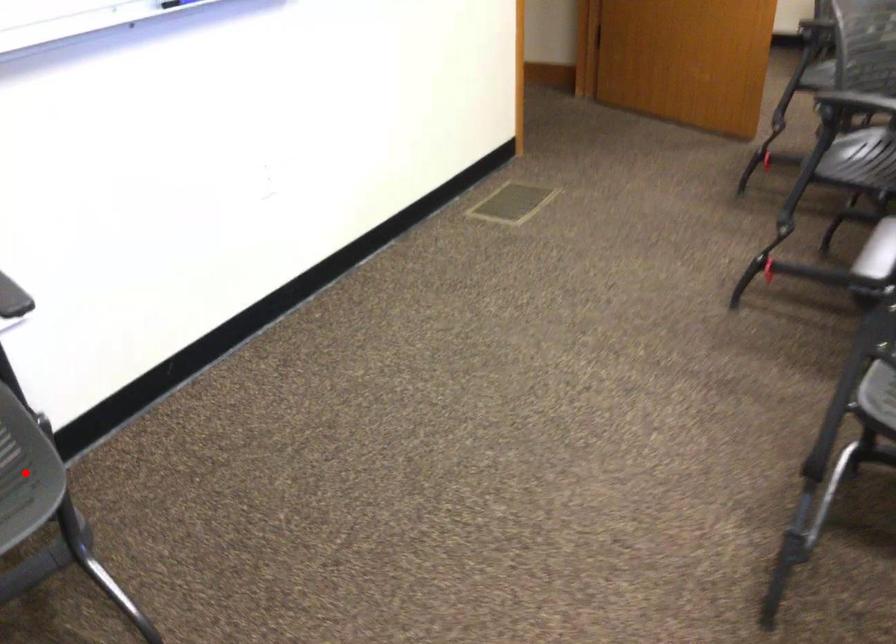
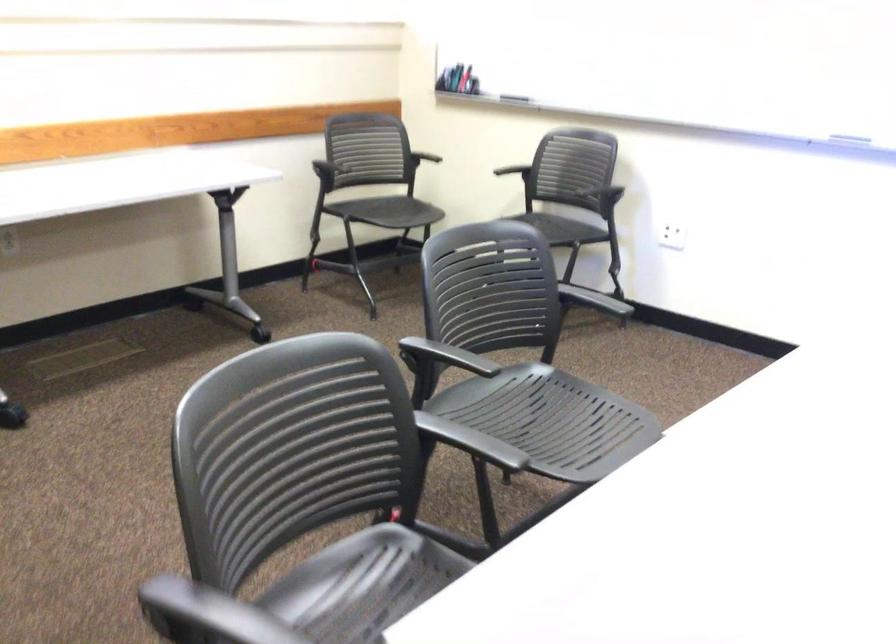
Question: I am providing you with two images of the same scene from different viewpoints. A red point is marked on the first image. Is the red point's position out of view in image 2?

Choices:
 (A) Yes
 (B) No

Answer: (A)